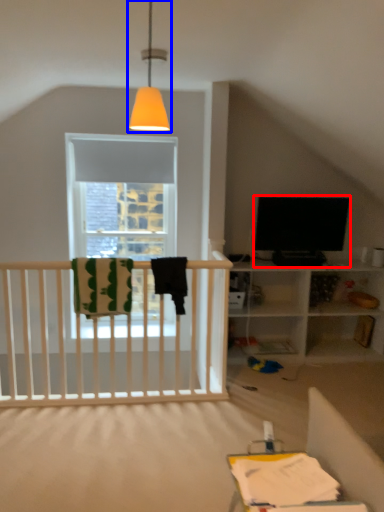
Question: Which object appears farthest to the camera in this image, television (highlighted by a red box) or lamp (highlighted by a blue box)?

Choices:
 (A) television
 (B) lamp

Answer: (A)